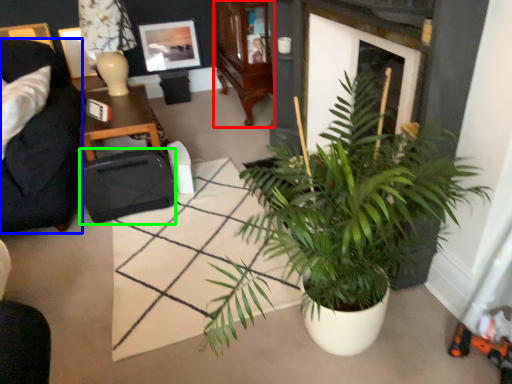
Question: Which object is the farthest from cabinetry (highlighted by a red box)? Choose among these: studio couch (highlighted by a blue box) or luggage and bags (highlighted by a green box).

Choices:
 (A) studio couch
 (B) luggage and bags

Answer: (A)